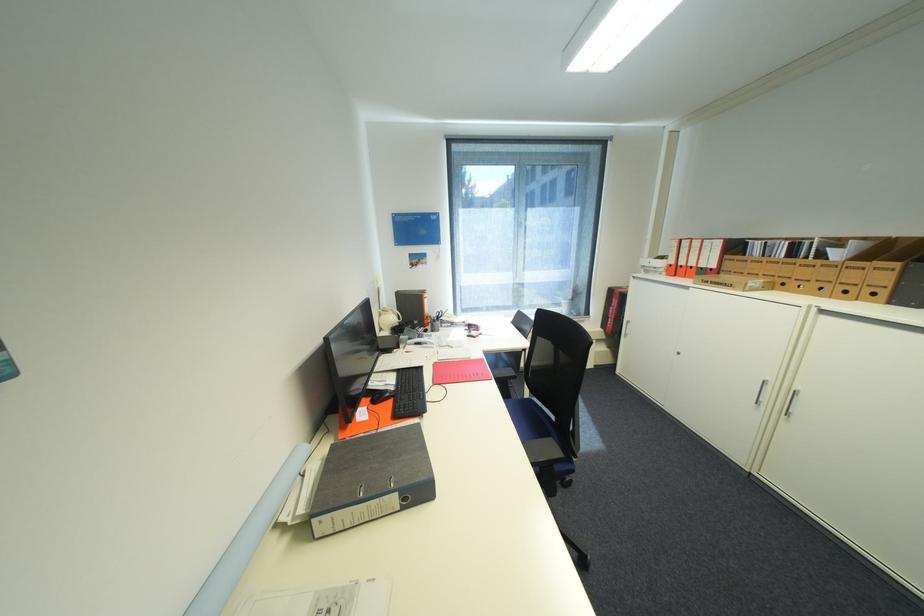
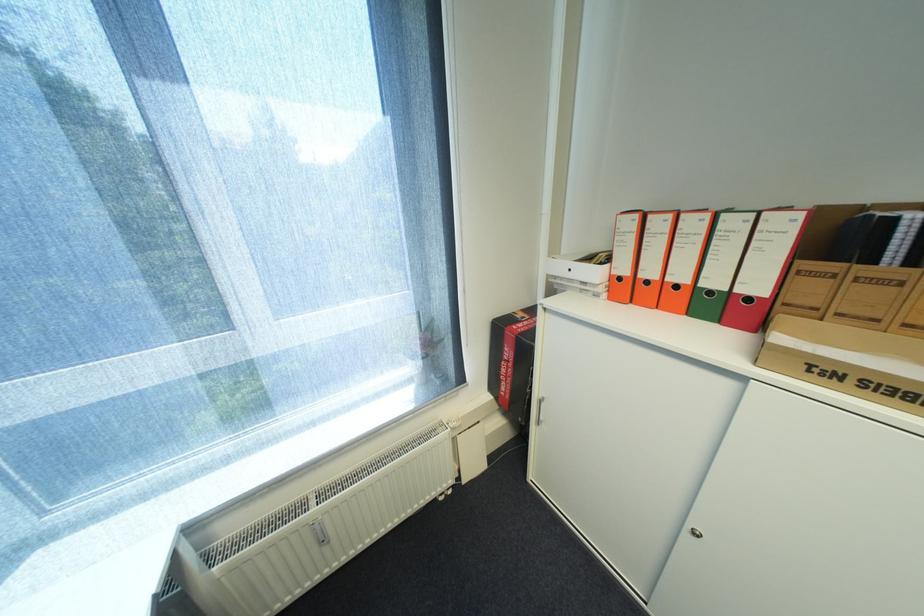
Locate, in the second image, the point that corresponds to pixel 734 262 in the first image.

(806, 282)